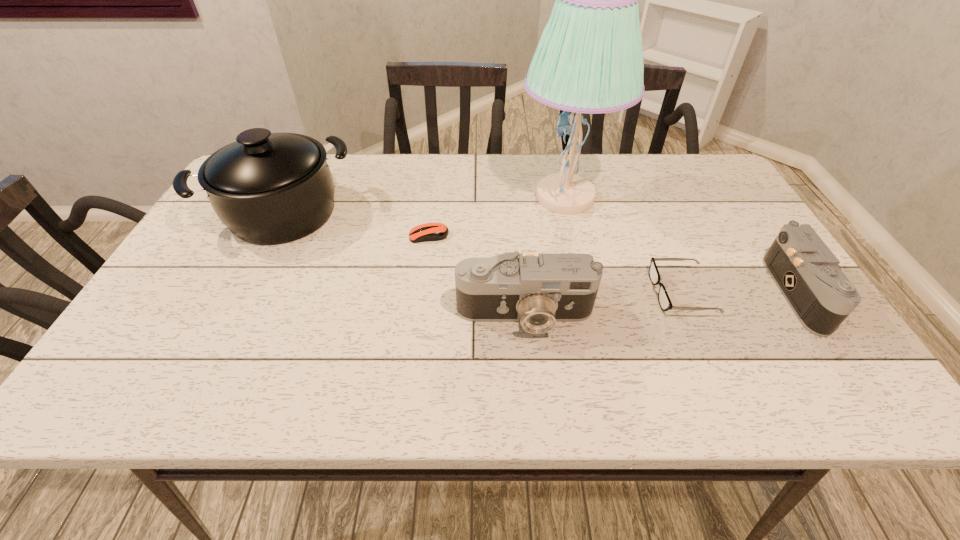
The width and height of the screenshot is (960, 540). In order to click on the left camera in this screenshot , I will do `click(537, 291)`.

Find the location of a particular element. Image resolution: width=960 pixels, height=540 pixels. the taller camera is located at coordinates (537, 291).

Where is `the shorter camera`? This screenshot has width=960, height=540. the shorter camera is located at coordinates (808, 274).

Locate an element on the screen. the fourth tallest object is located at coordinates (808, 274).

Image resolution: width=960 pixels, height=540 pixels. In order to click on lamp in this screenshot , I will do `click(589, 59)`.

Locate an element on the screen. the leftmost object is located at coordinates [x=268, y=188].

I want to click on the second tallest object, so click(268, 188).

You are a GUI agent. You are given a task and a screenshot of the screen. Output one action in this format:
    pyautogui.click(x=<x>, y=<y>)
    Task: Click on the computer mouse
    
    Given the screenshot: What is the action you would take?
    pyautogui.click(x=435, y=231)

The height and width of the screenshot is (540, 960). What are the coordinates of `the shortest object` in the screenshot? It's located at (435, 231).

Find the location of a particular element. Image resolution: width=960 pixels, height=540 pixels. the second object from right to left is located at coordinates (665, 303).